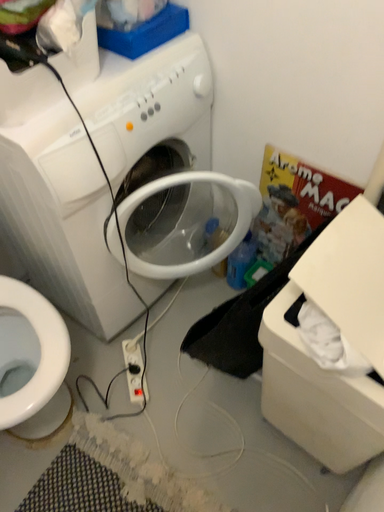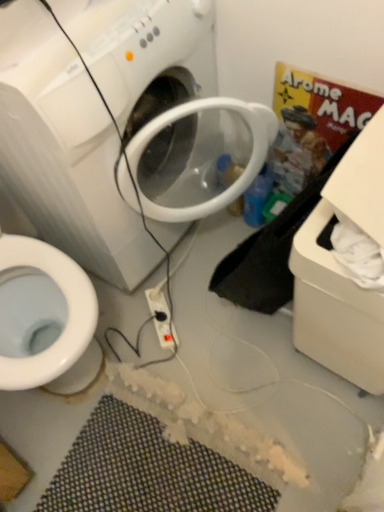
Question: Which way did the camera rotate in the video?

Choices:
 (A) rotated downward
 (B) rotated upward

Answer: (A)